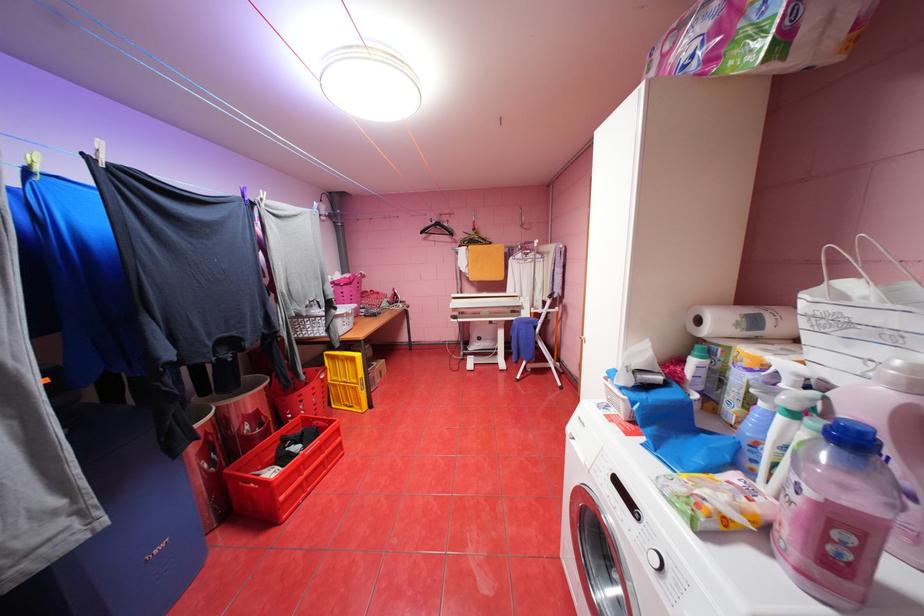
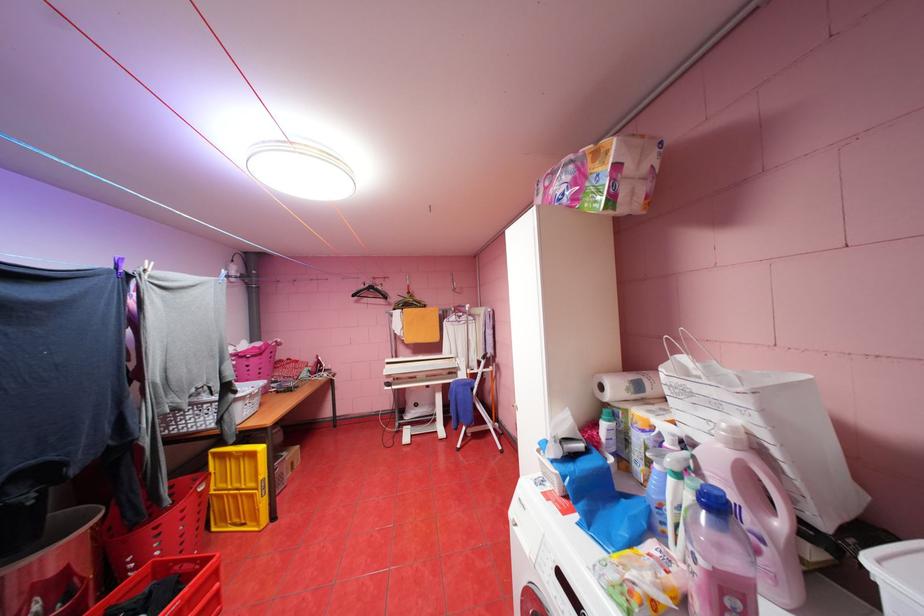
Find the pixel in the second image that matches point 862,540 in the first image.

(748, 604)